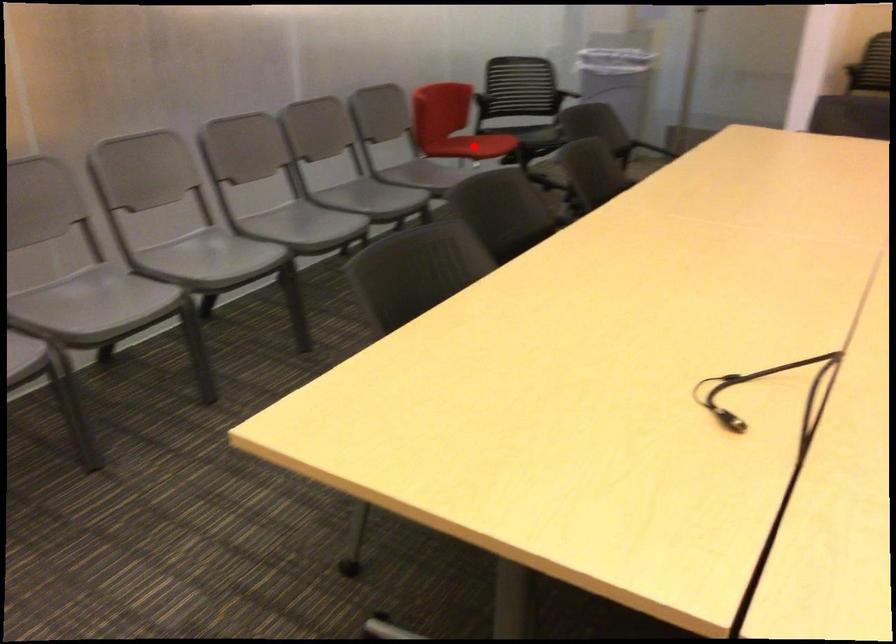
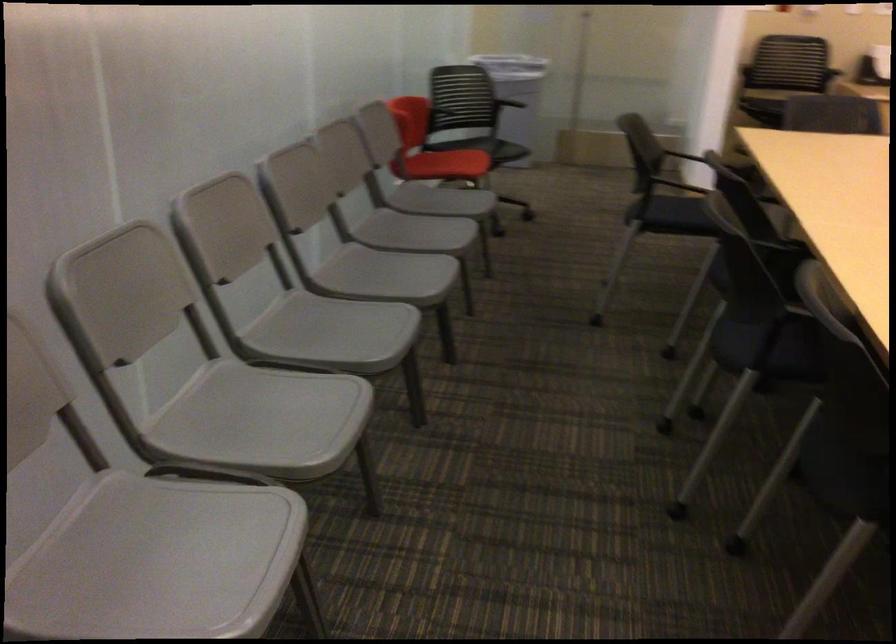
In the second image, find the point that corresponds to the highlighted location in the first image.

(446, 164)